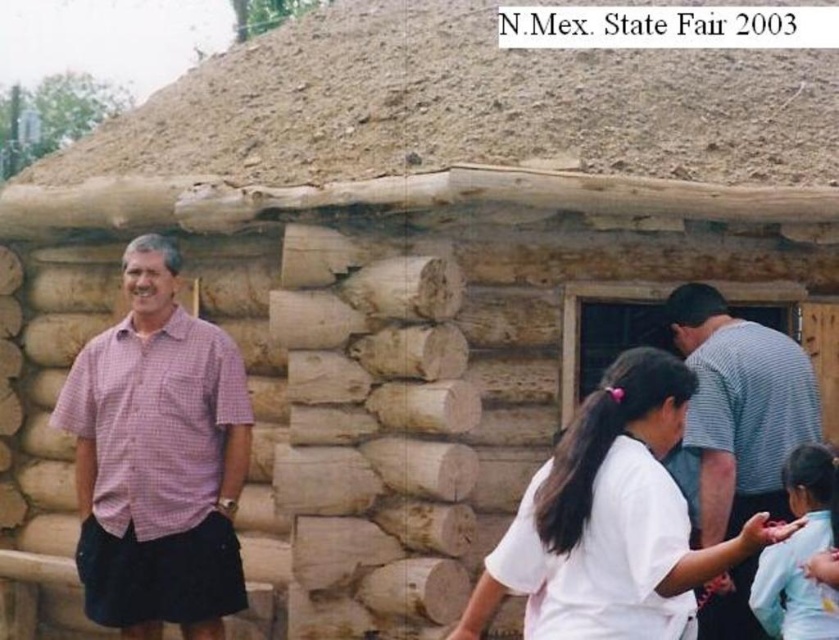
Does pink checkered shirt at left appear on the left side of gray striped shirt at right?

Indeed, pink checkered shirt at left is positioned on the left side of gray striped shirt at right.

Who is more distant from viewer, (x=136, y=476) or (x=753, y=336)?

Point (x=136, y=476)

Who is more forward, (x=86, y=480) or (x=790, y=400)?

Point (x=790, y=400)

Find the location of a particular element. pink checkered shirt at left is located at coordinates (159, 460).

Is point (243, 438) positioned before point (830, 630)?

That is False.

You are a GUI agent. You are given a task and a screenshot of the screen. Output one action in this format:
    pyautogui.click(x=<x>, y=<y>)
    Task: Click on the pink checkered shirt at left
    Image resolution: width=839 pixels, height=640 pixels.
    Given the screenshot: What is the action you would take?
    pyautogui.click(x=159, y=460)

The height and width of the screenshot is (640, 839). In order to click on pink checkered shirt at left in this screenshot , I will do `click(159, 460)`.

Where is `pink checkered shirt at left`? pink checkered shirt at left is located at coordinates (159, 460).

Who is positioned more to the left, white matte shirt at center or gray striped shirt at right?

white matte shirt at center is more to the left.

Is white matte shirt at center bigger than gray striped shirt at right?

No.

At what (x,y) coordinates should I click in order to perform the action: click on white matte shirt at center. Please return your answer as a coordinate pair (x, y). Image resolution: width=839 pixels, height=640 pixels. Looking at the image, I should click on (611, 520).